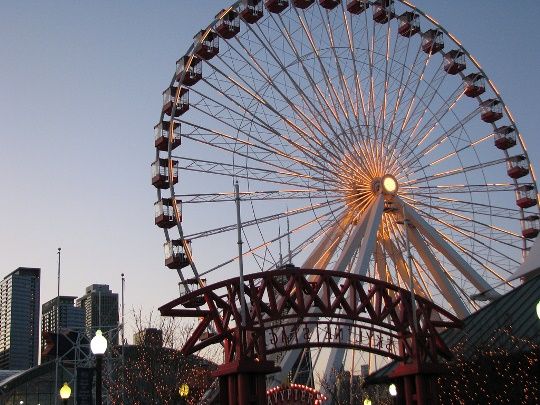
Where is `white beams`? white beams is located at coordinates [364, 255], [344, 256], [326, 258], [317, 254], [377, 271], [401, 264], [425, 261], [452, 254].